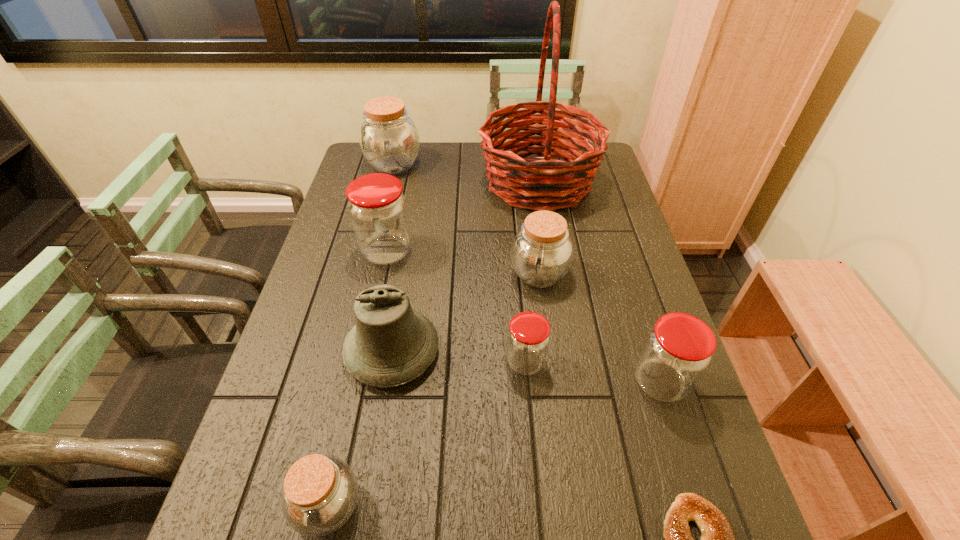
Where is `the second red jar from right to left`? the second red jar from right to left is located at coordinates (528, 337).

The height and width of the screenshot is (540, 960). What are the coordinates of `free spot located on the front of the tallest object` in the screenshot? It's located at (553, 274).

The width and height of the screenshot is (960, 540). I want to click on vacant space located 0.300m on the front of the farthest jar, so click(375, 238).

Locate an element on the screen. Image resolution: width=960 pixels, height=540 pixels. free spot located on the front of the farthest red jar is located at coordinates (367, 344).

Where is `vacant space located 0.220m on the front of the bell`? vacant space located 0.220m on the front of the bell is located at coordinates (368, 502).

Locate an element on the screen. The height and width of the screenshot is (540, 960). vacant space positioned 0.320m on the back of the second nearest brown jar is located at coordinates (528, 190).

At what (x,y) coordinates should I click in order to perform the action: click on free space located 0.210m on the back of the second biggest red jar. Please return your answer as a coordinate pair (x, y). Looking at the image, I should click on (631, 292).

Locate an element on the screen. vacant position located on the left of the smallest red jar is located at coordinates (449, 362).

The image size is (960, 540). I want to click on basket that is at the far edge, so click(x=523, y=183).

Find the location of `jar located at the far edge`. jar located at the far edge is located at coordinates (389, 139).